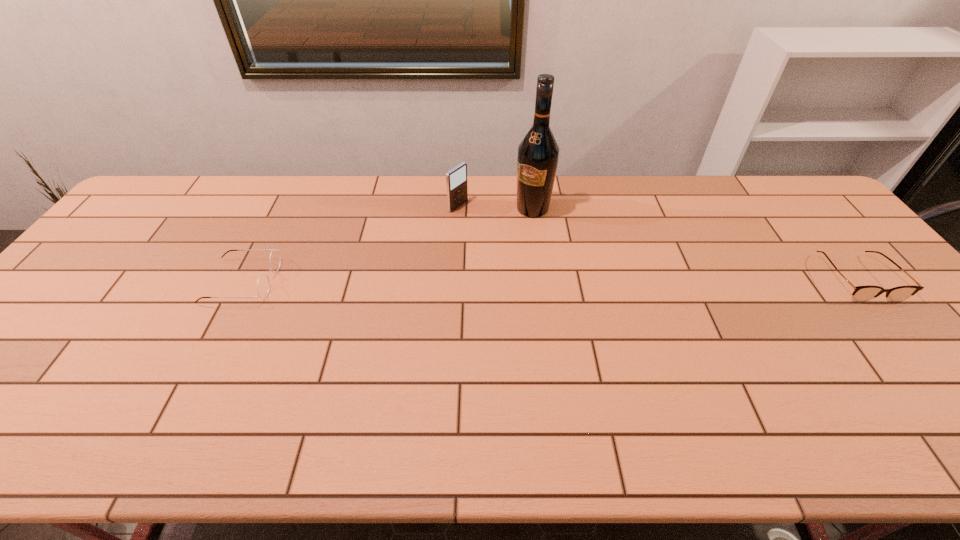
Where is `the leftmost object`? The image size is (960, 540). the leftmost object is located at coordinates (263, 284).

Where is `the right spectacles`? The width and height of the screenshot is (960, 540). the right spectacles is located at coordinates (861, 293).

Find the location of `wine bottle`. wine bottle is located at coordinates (537, 160).

You are a GUI agent. You are given a task and a screenshot of the screen. Output one action in this format:
    pyautogui.click(x=<x>, y=<y>)
    Task: Click on the third object from left to right
    Image resolution: width=960 pixels, height=540 pixels.
    Given the screenshot: What is the action you would take?
    pyautogui.click(x=537, y=160)

At what (x,y) coordinates should I click in order to perform the action: click on the second tallest object. Please return your answer as a coordinate pair (x, y). Image resolution: width=960 pixels, height=540 pixels. Looking at the image, I should click on (456, 179).

Locate an element on the screen. The width and height of the screenshot is (960, 540). iPod is located at coordinates (456, 179).

Image resolution: width=960 pixels, height=540 pixels. Identify the location of vacant area situated 0.100m on the front-facing side of the leftmost object. (312, 281).

Locate an element on the screen. The image size is (960, 540). vacant region located on the face of the right spectacles is located at coordinates pyautogui.click(x=897, y=327).

Locate an element on the screen. vacant space positioned on the label of the tallest object is located at coordinates (473, 282).

The image size is (960, 540). Find the location of `free space located on the label of the tallest object`. free space located on the label of the tallest object is located at coordinates (494, 256).